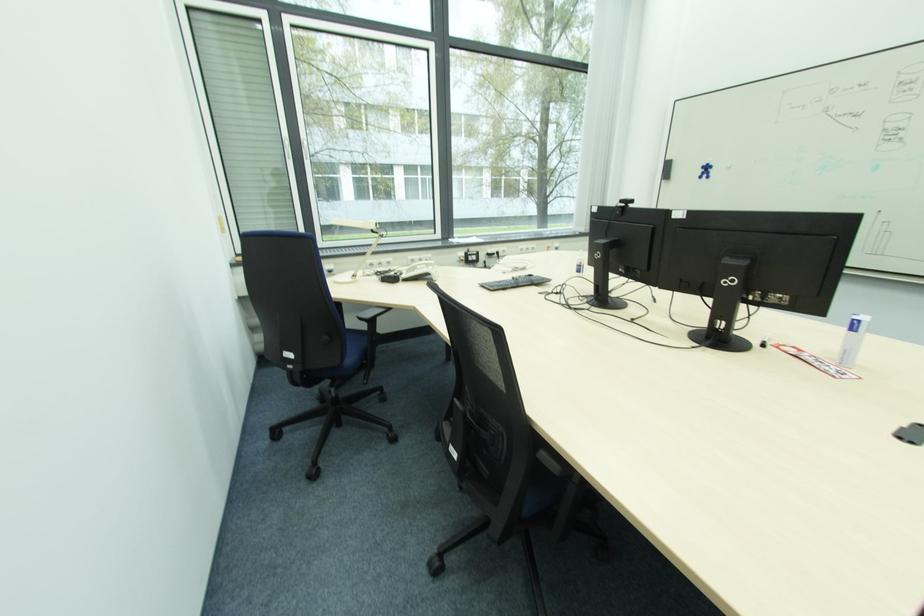
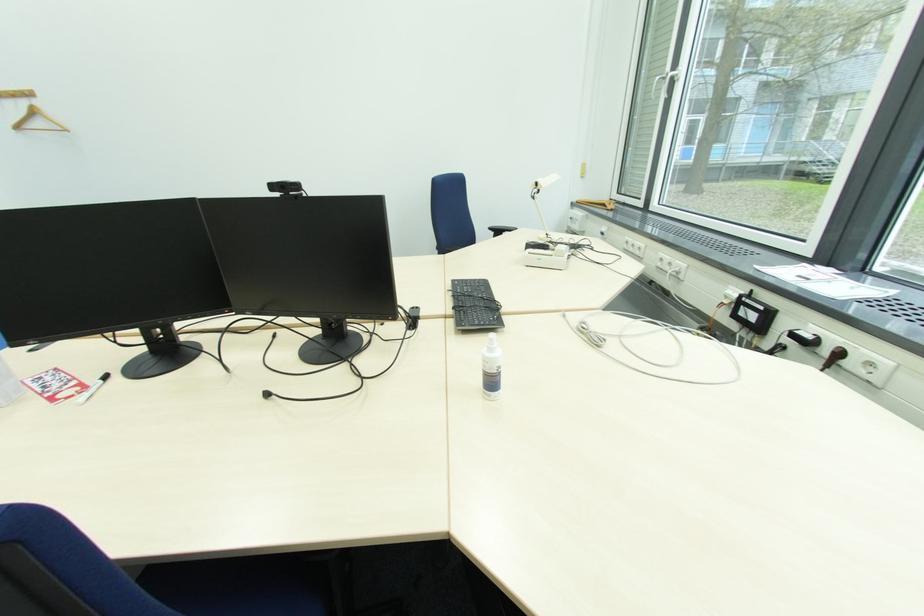
Find the pixel in the second image that matches (775,349) in the first image.

(100, 384)